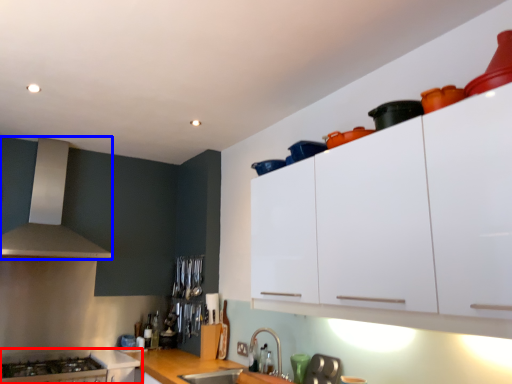
Question: Which point is closer to the camera, cabinetry (highlighted by a red box) or kitchen appliance (highlighted by a blue box)?

Choices:
 (A) cabinetry
 (B) kitchen appliance

Answer: (A)